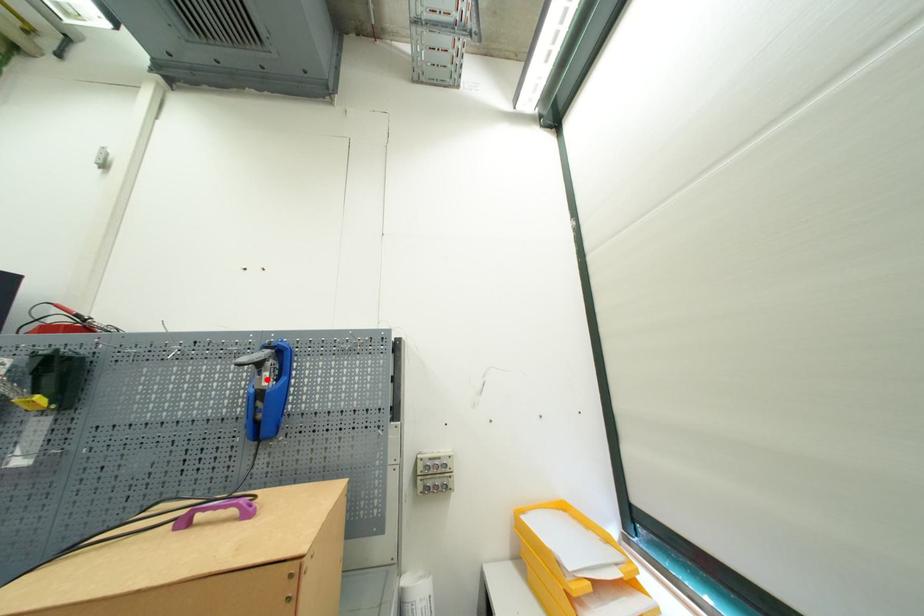
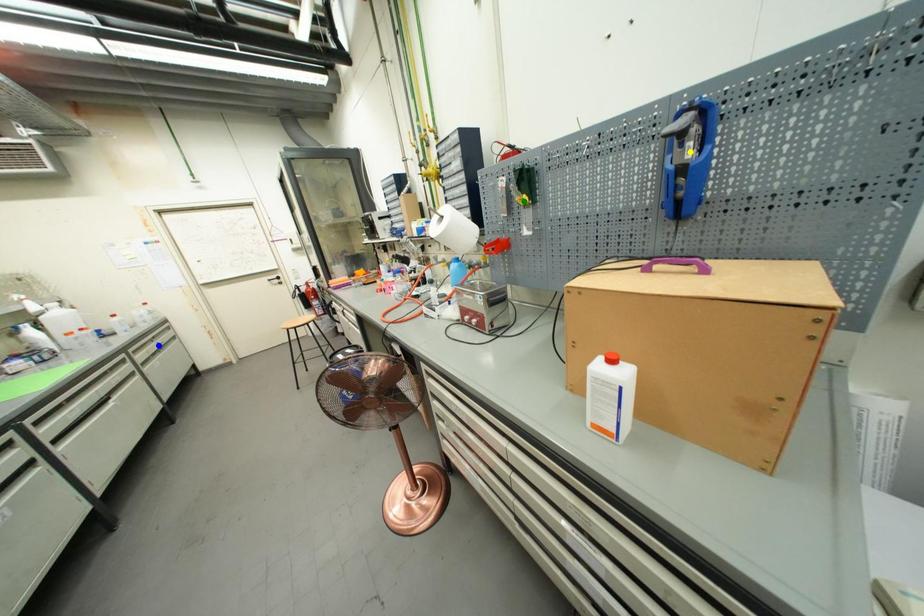
Question: I am providing you with two images of the same scene from different viewpoints. A red point is marked on the first image. You are given multiple points on the second image. Which spot in image 2 lines up with the point in image 1?

Choices:
 (A) yellow point
 (B) blue point
 (C) green point

Answer: (A)